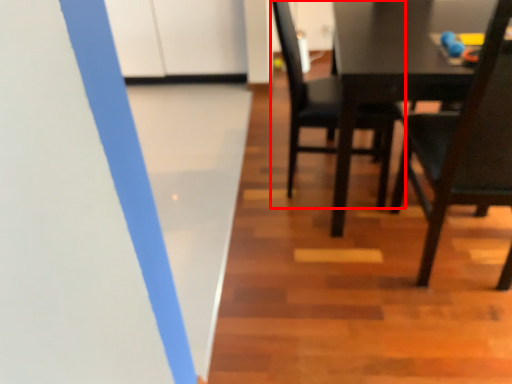
Question: From the image, what is the correct spatial relationship of chair (annotated by the red box) in relation to chair?

Choices:
 (A) right
 (B) left

Answer: (B)